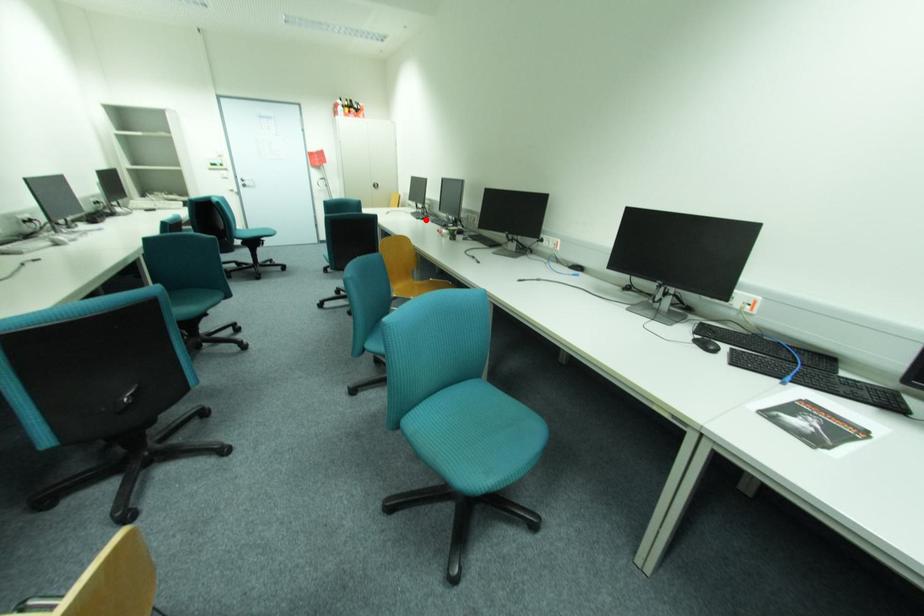
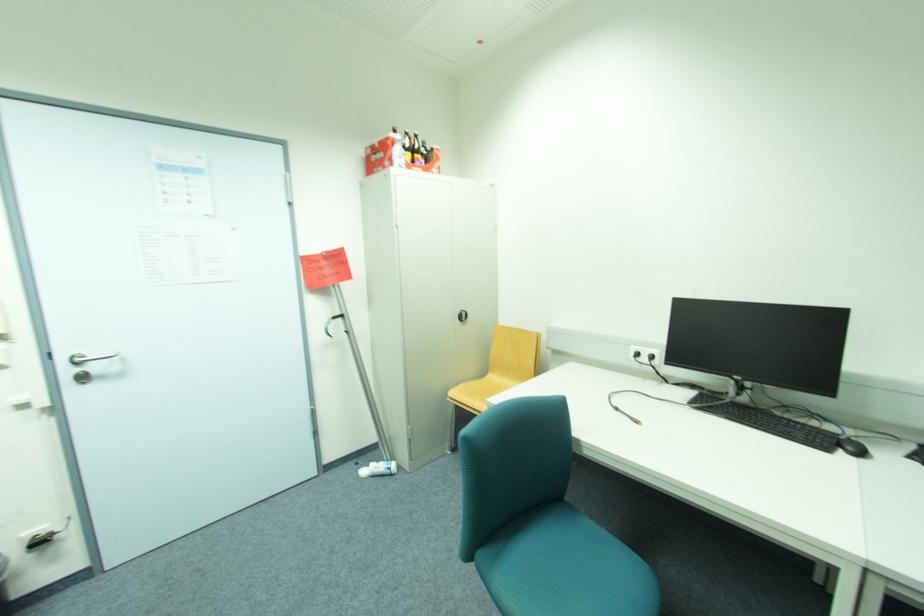
The point at the highlighted location is marked in the first image. Where is the corresponding point in the second image?

(847, 454)